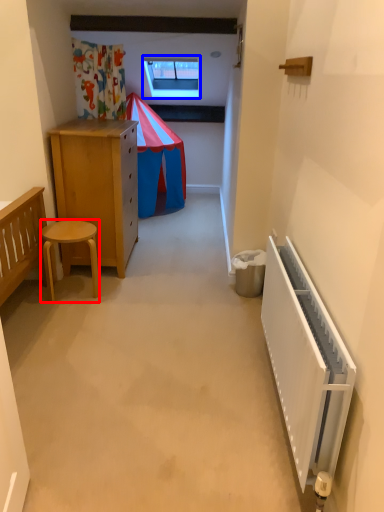
Question: Which object is closer to the camera taking this photo, stool (highlighted by a red box) or window (highlighted by a blue box)?

Choices:
 (A) stool
 (B) window

Answer: (A)